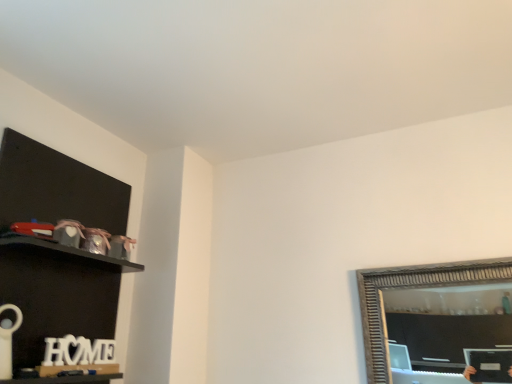
Image resolution: width=512 pixels, height=384 pixels. What do you see at coordinates (58, 293) in the screenshot? I see `black matte shelf at left` at bounding box center [58, 293].

Locate an element on the screen. This screenshot has height=384, width=512. black matte shelf at left is located at coordinates (58, 293).

Find the location of a particular element. The image size is (512, 384). black matte shelf at left is located at coordinates (58, 293).